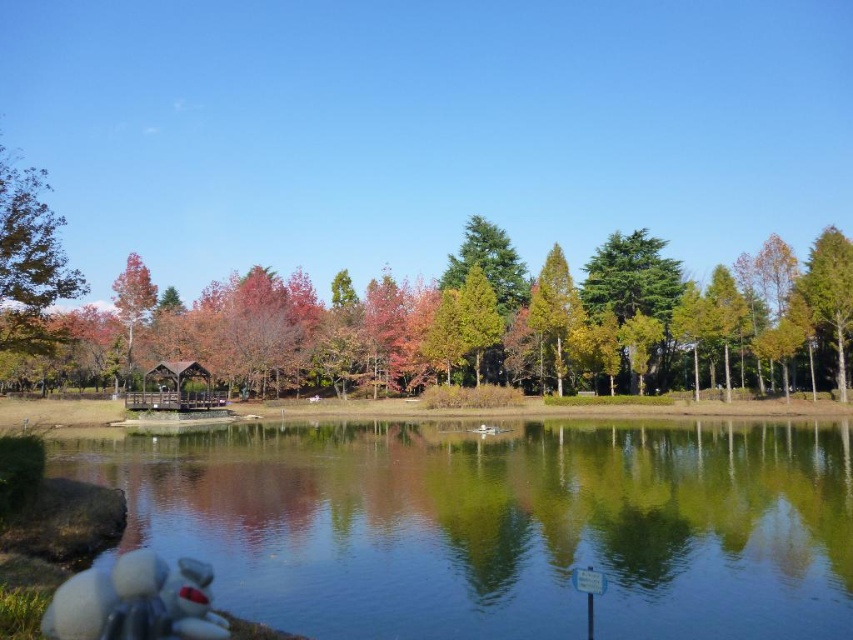
Question: Which of the following is the closest to the observer?

Choices:
 (A) clear glass water at lower left
 (B) autumn leaves at center
 (C) green matte tree at right
 (D) green matte tree at upper left

Answer: (A)

Question: Is autumn leaves at center wider than green matte tree at right?

Choices:
 (A) no
 (B) yes

Answer: (B)

Question: Which object is the farthest from the yellow-green textured tree at center?

Choices:
 (A) green matte tree at upper left
 (B) clear glass water at lower left
 (C) green matte tree at right
 (D) autumn leaves at center

Answer: (A)

Question: Which object appears closest to the camera in this image?

Choices:
 (A) clear glass water at lower left
 (B) yellow-green textured tree at center

Answer: (A)

Question: Does autumn leaves at center have a lesser width compared to yellow-green textured tree at center?

Choices:
 (A) no
 (B) yes

Answer: (A)

Question: Does clear glass water at lower left have a lesser width compared to autumn leaves at center?

Choices:
 (A) yes
 (B) no

Answer: (A)